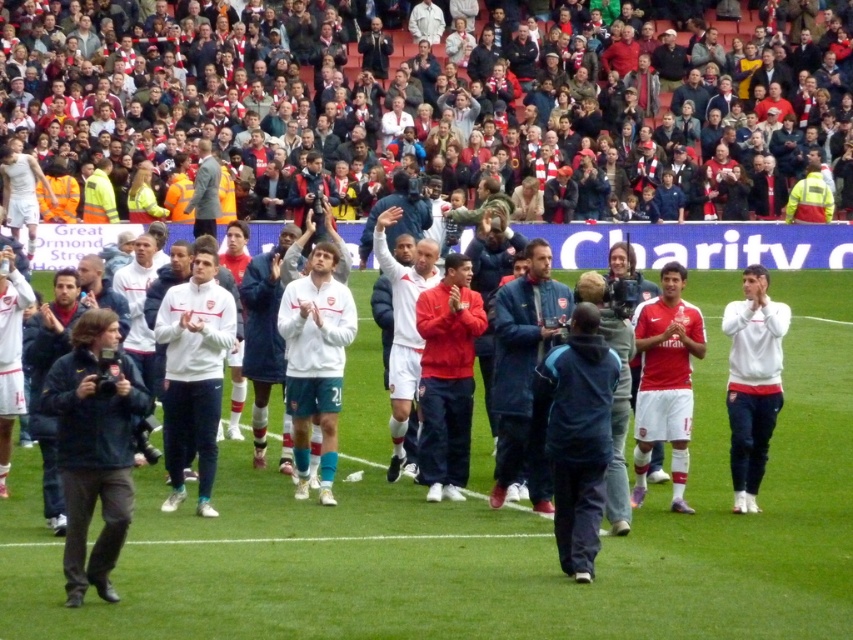
Does white matte jacket at center lie behind blue fabric jacket at center?

No, white matte jacket at center is closer to the viewer.

Is white matte jacket at center smaller than blue fabric jacket at center?

No, white matte jacket at center is not smaller than blue fabric jacket at center.

Is point (201, 513) positioned behind point (537, 284)?

That is False.

This screenshot has width=853, height=640. I want to click on white matte jacket at center, so click(135, 326).

Between red scarf at upper center and white matte jacket at center, which one appears on the right side from the viewer's perspective?

red scarf at upper center is more to the right.

Which is behind, point (122, 138) or point (136, 243)?

The point (122, 138) is behind.

Find the location of a particular element. The width and height of the screenshot is (853, 640). red scarf at upper center is located at coordinates (323, 88).

This screenshot has width=853, height=640. I want to click on red scarf at upper center, so click(323, 88).

Is red scarf at upper center positioned in front of blue fabric jacket at center?

No, it is behind blue fabric jacket at center.

This screenshot has width=853, height=640. What do you see at coordinates (323, 88) in the screenshot?
I see `red scarf at upper center` at bounding box center [323, 88].

I want to click on red scarf at upper center, so click(x=323, y=88).